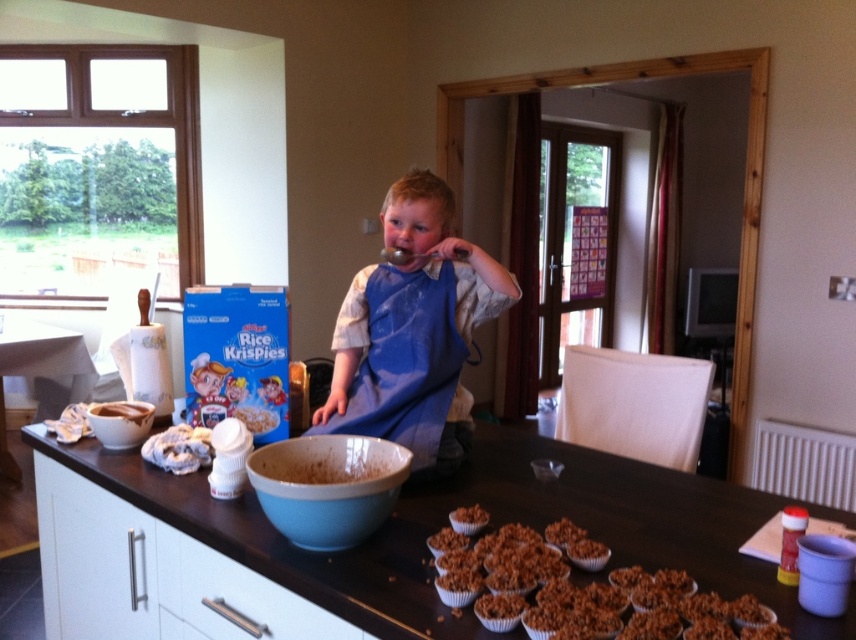
You are a parent standing in the kitchen and want to hand your child a cookie cutter. The cookie cutter is on the counter behind the blue fabric apron at center. Can you safely reach it without bending down?

The blue fabric apron at center is 1.60 meters away from the viewer. Since the cookie cutter is behind the apron, you would need to reach past it, but the distance might make it difficult. However, since the apron is part of the child, you might need to move closer or ask the child to step aside for a safer reach.

In the kitchen scene, there are a matte white bowl at counter center and crispy brown cereal at center. Which object is bigger?

The matte white bowl at counter center is larger in size compared to the crispy brown cereal at center.